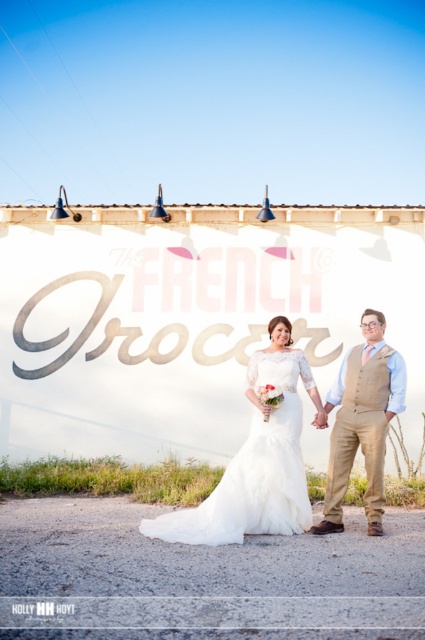
Based on the wedding scene described, if you were standing at point (388, 371), would the point (246, 381) be visible to you? Please explain using their positions.

Point (246, 381) is behind point (388, 371), so if you were standing at point (388, 371), the point (246, 381) would not be visible to you because it is located behind the other point.

Based on the scene description, which object has a larger size between the white satin dress at center and the tan fabric vest at center?

The white satin dress at center has a larger size compared to the tan fabric vest at center.

From the picture: You are a photographer at the wedding. You need to adjust the lighting to ensure both the white satin dress at center and the tan fabric vest at center are well lit. Which one is closer to the ground and requires lower lighting adjustments?

The white satin dress at center is located below the tan fabric vest at center, so it is closer to the ground and requires lower lighting adjustments.